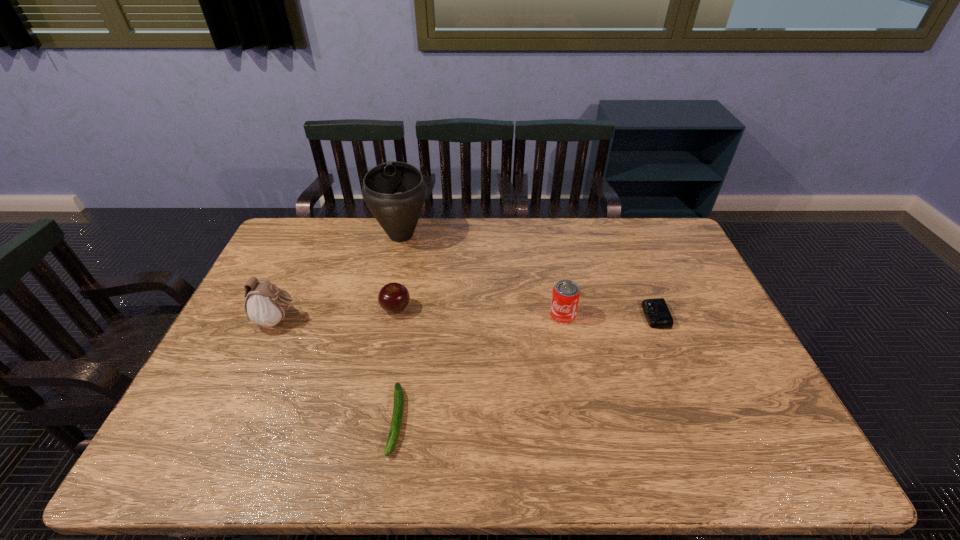
Identify the location of free space located on the front-facing side of the fifth shortest object. (406, 320).

Locate an element on the screen. The height and width of the screenshot is (540, 960). vacant space located on the left of the can is located at coordinates (423, 315).

Find the location of a particular element. free region located on the back of the apple is located at coordinates (403, 273).

Where is `vacant space located 0.140m on the display of the alarm clock`? vacant space located 0.140m on the display of the alarm clock is located at coordinates (598, 315).

Where is `vacant region located 0.170m on the display of the alarm clock`? The height and width of the screenshot is (540, 960). vacant region located 0.170m on the display of the alarm clock is located at coordinates (588, 315).

At what (x,y) coordinates should I click in order to perform the action: click on free space located 0.380m on the display of the alarm clock. Please return your answer as a coordinate pair (x, y). Looking at the image, I should click on (518, 315).

Identify the location of object present at the far edge. The height and width of the screenshot is (540, 960). (395, 192).

The width and height of the screenshot is (960, 540). I want to click on object that is positioned at the near edge, so click(398, 408).

Identify the location of object positioned at the left edge. The height and width of the screenshot is (540, 960). (265, 305).

The image size is (960, 540). I want to click on object positioned at the right edge, so click(656, 311).